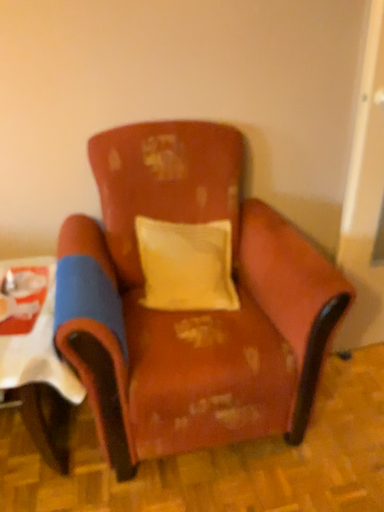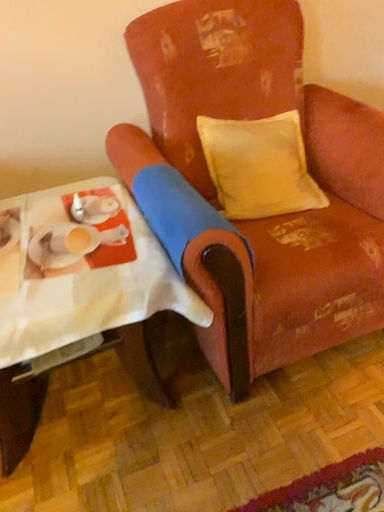
Question: Which way did the camera rotate in the video?

Choices:
 (A) rotated upward
 (B) rotated downward

Answer: (B)